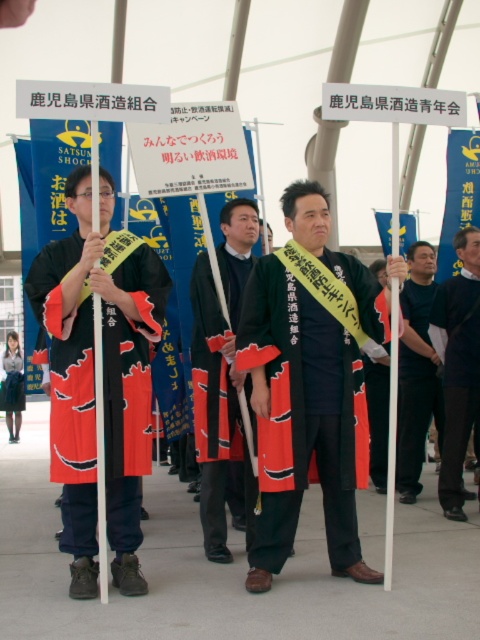
Question: Where is matte black robe at center located in relation to red velvet kimono at center in the image?

Choices:
 (A) below
 (B) above

Answer: (A)

Question: Can you confirm if red velvet kimono at center is positioned above dark gray shirt at center?

Choices:
 (A) yes
 (B) no

Answer: (B)

Question: Which point is farther from the camera taking this photo?

Choices:
 (A) (148, 356)
 (B) (227, 433)
 (C) (300, 305)
 (D) (465, 323)

Answer: (D)

Question: Is matte black robe at center in front of black matte kimono at center?

Choices:
 (A) no
 (B) yes

Answer: (B)

Question: Which object is the closest to the black matte kimono at center?

Choices:
 (A) red velvet kimono at center
 (B) matte black robe at center

Answer: (B)

Question: Based on their relative distances, which object is nearer to the black matte kimono at center?

Choices:
 (A) red velvet kimono at center
 (B) dark gray shirt at center
 (C) matte black robe at center

Answer: (C)